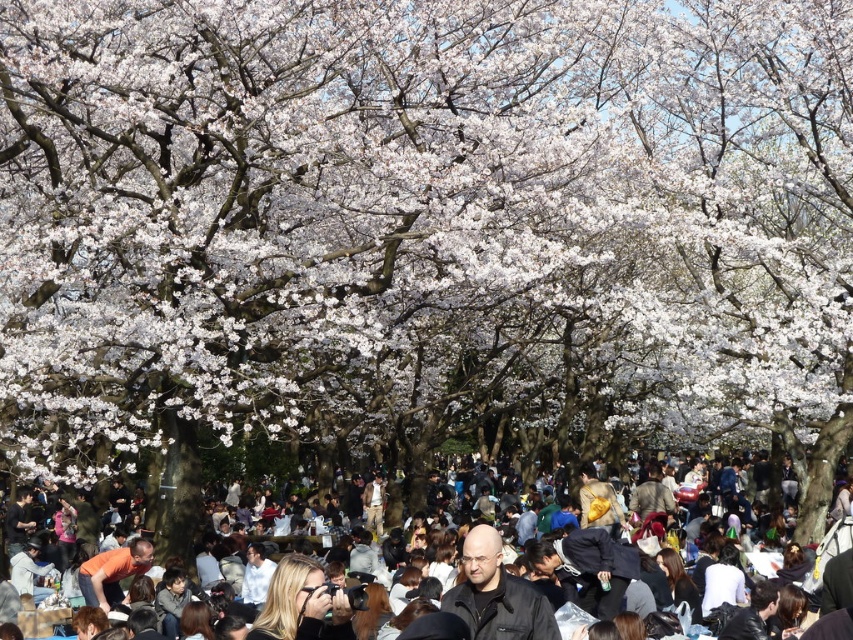
In the scene shown: Which is below, black leather jacket at center or matte black jacket at lower center?

black leather jacket at center is lower down.

Is point (450, 592) positioned after point (601, 529)?

That is False.

Where is `black leather jacket at center`? The width and height of the screenshot is (853, 640). black leather jacket at center is located at coordinates (496, 595).